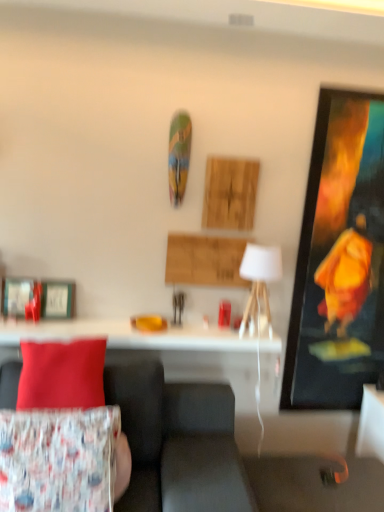
Measure the distance between point (237, 339) and camera.

Point (237, 339) and camera are 2.44 meters apart from each other.

This screenshot has height=512, width=384. What do you see at coordinates (62, 375) in the screenshot?
I see `matte red pillow at left, acting as the 2th pillow starting from the bottom` at bounding box center [62, 375].

Find the location of a particular element. matte red pillow at left, which is counted as the 1th pillow, starting from the top is located at coordinates (62, 375).

The image size is (384, 512). Describe the element at coordinates (57, 298) in the screenshot. I see `metallic silver picture frame at left` at that location.

Image resolution: width=384 pixels, height=512 pixels. What do you see at coordinates (259, 283) in the screenshot?
I see `white fabric lampshade at center` at bounding box center [259, 283].

This screenshot has width=384, height=512. I want to click on white glossy table at center, so click(128, 335).

Are matte red pillow at left, acting as the 2th pillow starting from the bottom, and metallic silver picture frame at left far apart?

No, there isn't a large distance between matte red pillow at left, acting as the 2th pillow starting from the bottom, and metallic silver picture frame at left.

In terms of width, does matte red pillow at left, which is counted as the 1th pillow, starting from the top, look wider or thinner when compared to metallic silver picture frame at left?

Clearly, matte red pillow at left, which is counted as the 1th pillow, starting from the top, has more width compared to metallic silver picture frame at left.

Is matte red pillow at left, which is counted as the 1th pillow, starting from the top, outside of metallic silver picture frame at left?

matte red pillow at left, which is counted as the 1th pillow, starting from the top, is positioned outside metallic silver picture frame at left.

From a real-world perspective, who is located lower, velvet fabric couch at lower left or white glossy table at center?

velvet fabric couch at lower left.

What are the coordinates of `studio couch to the left of white glossy table at center` in the screenshot? It's located at (178, 442).

Which of these two, velvet fabric couch at lower left or white glossy table at center, is wider?

velvet fabric couch at lower left is wider.

In the scene shown: How much distance is there between velvet fabric couch at lower left and white glossy table at center?

19.08 inches.

Is white fabric lampshade at center directly adjacent to matte red pillow at left, which is counted as the 1th pillow, starting from the top?

No, white fabric lampshade at center is not with matte red pillow at left, which is counted as the 1th pillow, starting from the top.

How distant is white fabric lampshade at center from matte red pillow at left, which is counted as the 1th pillow, starting from the top?

white fabric lampshade at center and matte red pillow at left, which is counted as the 1th pillow, starting from the top, are 38.71 inches apart.

What's the angular difference between white fabric lampshade at center and matte red pillow at left, which is counted as the 1th pillow, starting from the top,'s facing directions?

white fabric lampshade at center and matte red pillow at left, which is counted as the 1th pillow, starting from the top, are facing 3.35 degrees away from each other.

Is point (254, 304) behind point (53, 403)?

Yes, it is behind point (53, 403).

How many degrees apart are the facing directions of floral fabric cushion at lower left, the 2th pillow positioned from the top, and metallic silver picture frame at left?

They differ by 5.23 degrees in their facing directions.

Which of these two, floral fabric cushion at lower left, the first pillow when ordered from bottom to top, or metallic silver picture frame at left, stands shorter?

With less height is metallic silver picture frame at left.

Considering the relative sizes of floral fabric cushion at lower left, the 2th pillow positioned from the top, and metallic silver picture frame at left in the image provided, is floral fabric cushion at lower left, the 2th pillow positioned from the top, wider than metallic silver picture frame at left?

Correct, the width of floral fabric cushion at lower left, the 2th pillow positioned from the top, exceeds that of metallic silver picture frame at left.

Is metallic silver picture frame at left at the back of floral fabric cushion at lower left, the first pillow when ordered from bottom to top?

No.

Is metallic silver picture frame at left far away from velvet fabric couch at lower left?

No, metallic silver picture frame at left is in close proximity to velvet fabric couch at lower left.

Who is shorter, metallic silver picture frame at left or velvet fabric couch at lower left?

With less height is metallic silver picture frame at left.

From a real-world perspective, which object stands above the other?

From a 3D spatial view, metallic silver picture frame at left is above.

How many degrees apart are the facing directions of metallic silver picture frame at left and velvet fabric couch at lower left?

There is a 1.21-degree angle between the facing directions of metallic silver picture frame at left and velvet fabric couch at lower left.

Find the location of a particular element. person below the white fabric lampshade at center (from a real-world perspective) is located at coordinates (62, 374).

Which is more distant, [43,394] or [280,259]?

The point [280,259] is behind.

Who is more distant, printed fabric cushion at lower left or white fabric lampshade at center?

white fabric lampshade at center is more distant.

Would you consider printed fabric cushion at lower left to be distant from white fabric lampshade at center?

printed fabric cushion at lower left is near white fabric lampshade at center, not far away.

You are a GUI agent. You are given a task and a screenshot of the screen. Output one action in this format:
    pyautogui.click(x=<x>, y=<y>)
    Task: Click on the picture frame behind the white glossy table at center
    
    Given the screenshot: What is the action you would take?
    pyautogui.click(x=57, y=298)

Does metallic silver picture frame at left appear on the left side of white glossy table at center?

Yes, metallic silver picture frame at left is to the left of white glossy table at center.

From the image's perspective, is metallic silver picture frame at left above or below white glossy table at center?

Based on their image positions, metallic silver picture frame at left is located above white glossy table at center.

What's the angular difference between metallic silver picture frame at left and white glossy table at center's facing directions?

The angular difference between metallic silver picture frame at left and white glossy table at center is 0.0174 degrees.

Locate an element on the screen. pillow that is the 1st object to the right of the metallic silver picture frame at left, starting at the anchor is located at coordinates (62, 375).

Find the location of `studio couch lying on the left of white glossy table at center`. studio couch lying on the left of white glossy table at center is located at coordinates (178, 442).

Which object lies further to the anchor point white fabric lampshade at center, metallic silver picture frame at left or printed fabric cushion at lower left?

metallic silver picture frame at left.

Looking at the image, which one is located further to white glossy table at center, floral fabric cushion at lower left, the first pillow when ordered from bottom to top, or white fabric lampshade at center?

Among the two, floral fabric cushion at lower left, the first pillow when ordered from bottom to top, is located further to white glossy table at center.

From the image, which object appears to be nearer to printed fabric cushion at lower left, white glossy table at center or metallic silver picture frame at left?

white glossy table at center.

Based on their spatial positions, is matte red pillow at left, acting as the 2th pillow starting from the bottom, or printed fabric cushion at lower left further from floral fabric cushion at lower left, the 2th pillow positioned from the top?

Among the two, matte red pillow at left, acting as the 2th pillow starting from the bottom, is located further to floral fabric cushion at lower left, the 2th pillow positioned from the top.

Considering their positions, is white glossy table at center positioned further to white fabric lampshade at center than velvet fabric couch at lower left?

velvet fabric couch at lower left is further to white fabric lampshade at center.

From the image, which object appears to be nearer to metallic silver picture frame at left, printed fabric cushion at lower left or matte red pillow at left, which is counted as the 1th pillow, starting from the top?

Based on the image, matte red pillow at left, which is counted as the 1th pillow, starting from the top, appears to be nearer to metallic silver picture frame at left.

From the image, which object appears to be nearer to matte red pillow at left, acting as the 2th pillow starting from the bottom, metallic silver picture frame at left or velvet fabric couch at lower left?

velvet fabric couch at lower left is positioned closer to the anchor matte red pillow at left, acting as the 2th pillow starting from the bottom.

Considering their positions, is printed fabric cushion at lower left positioned closer to floral fabric cushion at lower left, the 2th pillow positioned from the top, than velvet fabric couch at lower left?

printed fabric cushion at lower left is closer to floral fabric cushion at lower left, the 2th pillow positioned from the top.

Where is `person between velvet fabric couch at lower left and floral fabric cushion at lower left, the first pillow when ordered from bottom to top, from front to back`? The width and height of the screenshot is (384, 512). person between velvet fabric couch at lower left and floral fabric cushion at lower left, the first pillow when ordered from bottom to top, from front to back is located at coordinates (62, 374).

This screenshot has height=512, width=384. Identify the location of table between matte red pillow at left, acting as the 2th pillow starting from the bottom, and metallic silver picture frame at left from front to back. (128, 335).

You are a GUI agent. You are given a task and a screenshot of the screen. Output one action in this format:
    pyautogui.click(x=<x>, y=<y>)
    Task: Click on the table lamp between velvet fabric couch at lower left and metallic silver picture frame at left in the front-back direction
    
    Given the screenshot: What is the action you would take?
    pyautogui.click(x=259, y=283)

Identify the location of table between floral fabric cushion at lower left, the first pillow when ordered from bottom to top, and metallic silver picture frame at left in the front-back direction. Image resolution: width=384 pixels, height=512 pixels. (128, 335).